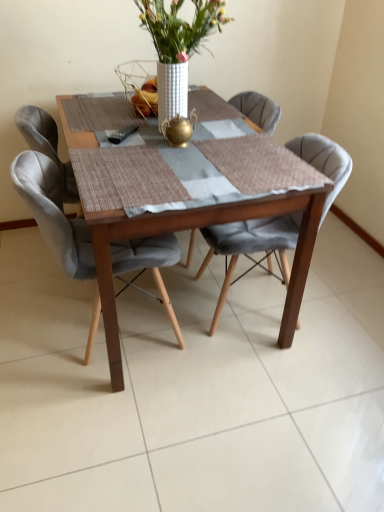
Question: Could white textured vase at center be considered to be inside velvet grey chair at center, the 1th chair viewed from the right?

Choices:
 (A) yes
 (B) no

Answer: (B)

Question: Considering the relative sizes of velvet grey chair at center, the 1th chair viewed from the right, and white textured vase at center in the image provided, is velvet grey chair at center, the 1th chair viewed from the right, smaller than white textured vase at center?

Choices:
 (A) yes
 (B) no

Answer: (B)

Question: Does velvet grey chair at center, the 1th chair viewed from the right, have a lesser width compared to white textured vase at center?

Choices:
 (A) yes
 (B) no

Answer: (B)

Question: Is velvet grey chair at center, the 1th chair viewed from the right, closer to the viewer compared to white textured vase at center?

Choices:
 (A) yes
 (B) no

Answer: (B)

Question: Can you confirm if velvet grey chair at center, which is the second chair from left to right, is bigger than white textured vase at center?

Choices:
 (A) yes
 (B) no

Answer: (A)

Question: Is velvet grey chair at center, which is the second chair from left to right, turned away from white textured vase at center?

Choices:
 (A) no
 (B) yes

Answer: (A)

Question: Is white textured vase at center taller than wooden table at center?

Choices:
 (A) yes
 (B) no

Answer: (B)

Question: Considering the relative sizes of white textured vase at center and wooden table at center in the image provided, is white textured vase at center wider than wooden table at center?

Choices:
 (A) yes
 (B) no

Answer: (B)

Question: From the image's perspective, is white textured vase at center located above wooden table at center?

Choices:
 (A) no
 (B) yes

Answer: (B)

Question: Does white textured vase at center have a smaller size compared to wooden table at center?

Choices:
 (A) yes
 (B) no

Answer: (A)

Question: Is white textured vase at center further to camera compared to wooden table at center?

Choices:
 (A) no
 (B) yes

Answer: (B)

Question: From a real-world perspective, is white textured vase at center located higher than wooden table at center?

Choices:
 (A) yes
 (B) no

Answer: (A)

Question: From a real-world perspective, is wooden table at center physically below white textured vase at center?

Choices:
 (A) yes
 (B) no

Answer: (A)